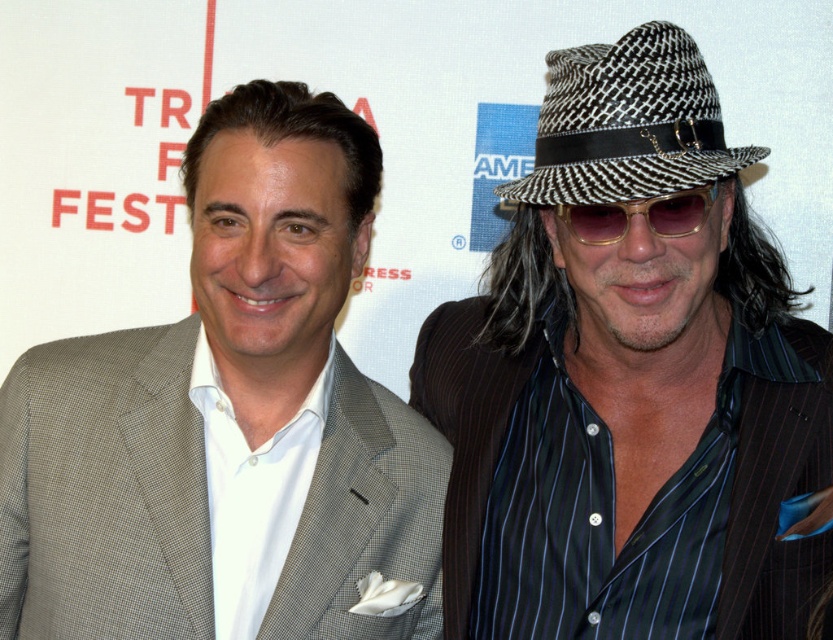
You are a photographer at the event and want to adjust your camera to focus on the black and white checkered hat at center. What coordinates should you set to ensure the hat is in the center of the frame?

The black and white checkered hat at center is already positioned at coordinates point [631,385], so setting the camera focus to those coordinates will center it in the frame.